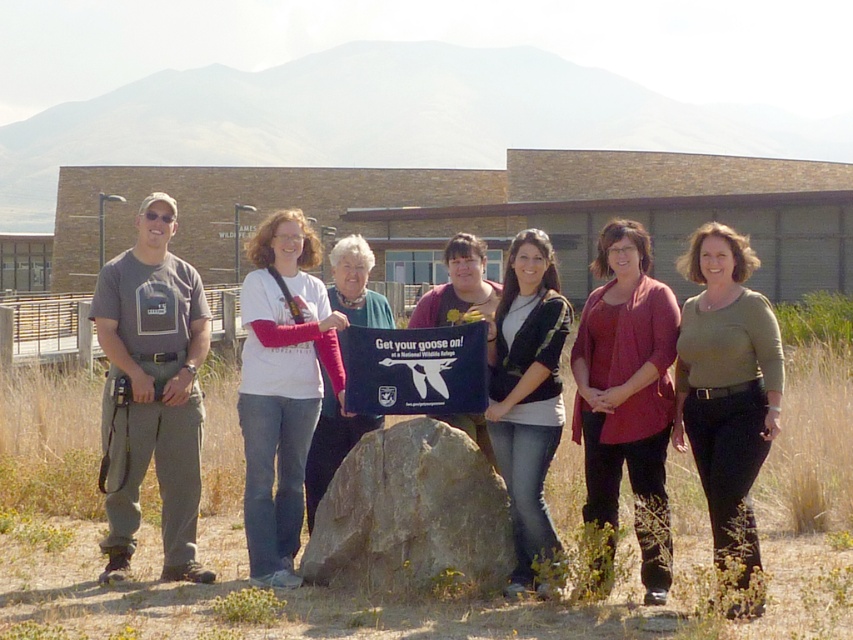
Between gray rock at center and blue fabric sign at center, which one is positioned higher?

blue fabric sign at center

Which is in front, point (436, 516) or point (396, 401)?

Point (436, 516)

This screenshot has width=853, height=640. Identify the location of gray rock at center. (410, 513).

Does gray cotton t-shirt at left have a greater height compared to matte black shirt at center?

Yes.

Can you confirm if gray cotton t-shirt at left is positioned to the left of matte black shirt at center?

Yes, gray cotton t-shirt at left is to the left of matte black shirt at center.

Image resolution: width=853 pixels, height=640 pixels. Find the location of `gray cotton t-shirt at left`. gray cotton t-shirt at left is located at coordinates click(x=155, y=387).

How distant is white cotton shirt at center from green matte shirt at center?

white cotton shirt at center and green matte shirt at center are 5.38 meters apart from each other.

Is point (241, 397) closer to viewer compared to point (721, 552)?

No, (241, 397) is further to viewer.

Who is more forward, (264,440) or (706,308)?

Point (706,308)

Where is `white cotton shirt at center`? white cotton shirt at center is located at coordinates (281, 387).